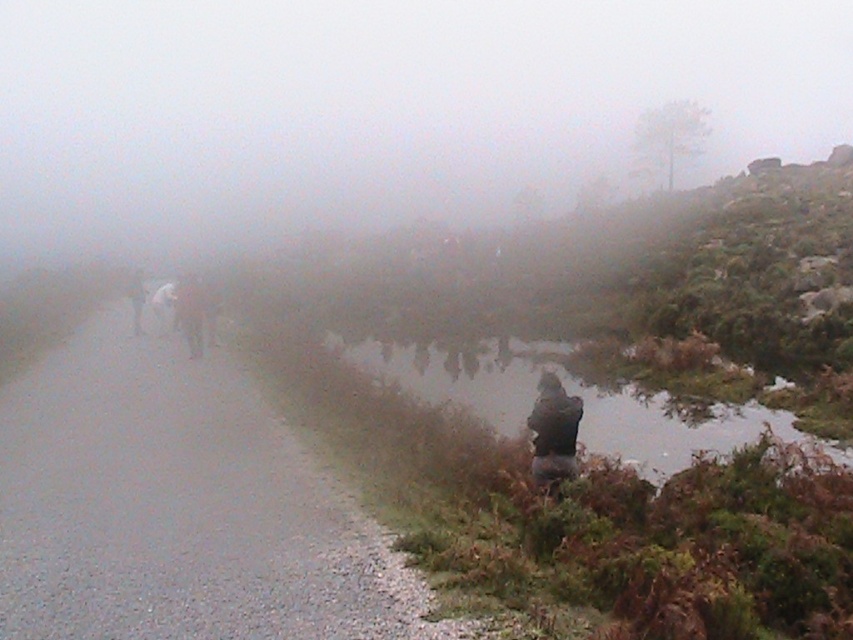
Question: Is brown leather jacket at left further to camera compared to white fabric jacket at left?

Choices:
 (A) yes
 (B) no

Answer: (B)

Question: Is gray gravel road at left positioned before white fabric jacket at left?

Choices:
 (A) yes
 (B) no

Answer: (A)

Question: Among these objects, which one is nearest to the camera?

Choices:
 (A) gray gravel road at left
 (B) white fabric jacket at left

Answer: (A)

Question: Which of the following is the farthest from the observer?

Choices:
 (A) gray gravel road at left
 (B) white fabric jacket at left

Answer: (B)

Question: Does gray gravel road at left have a larger size compared to brown leather jacket at left?

Choices:
 (A) no
 (B) yes

Answer: (A)

Question: Which point appears closest to the camera in this image?

Choices:
 (A) (135, 321)
 (B) (173, 326)

Answer: (A)